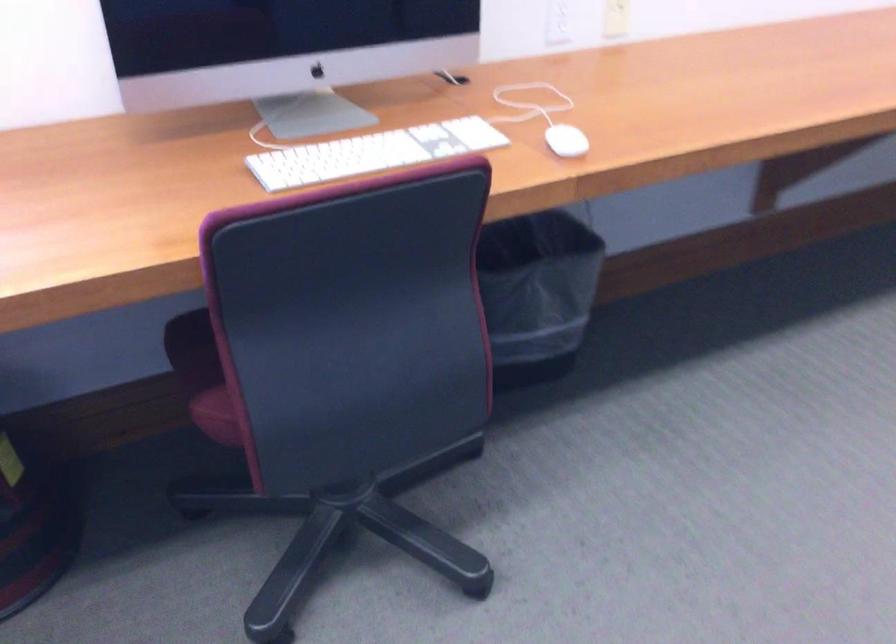
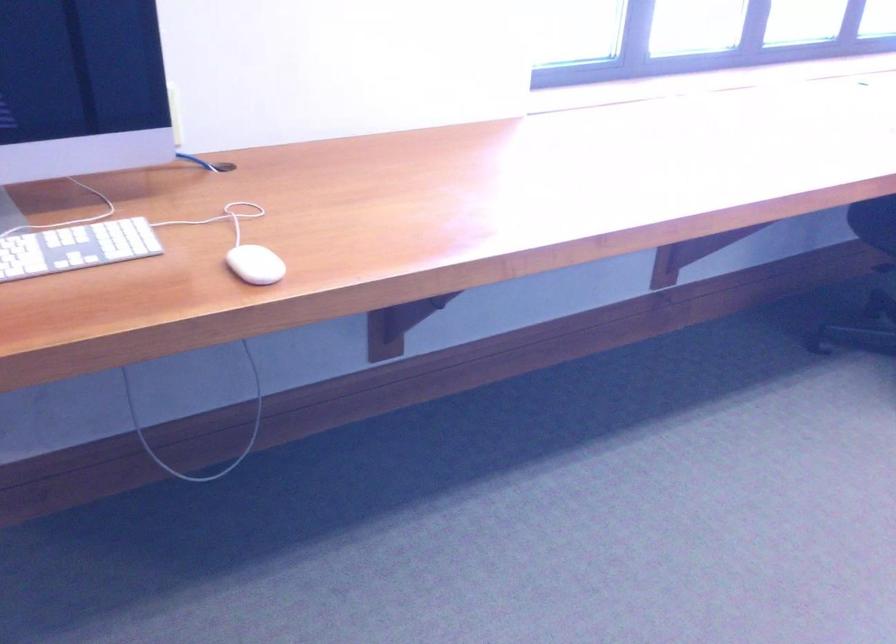
Which direction would the cameraman need to move to produce the second image?

The cameraman moved toward left, backward.